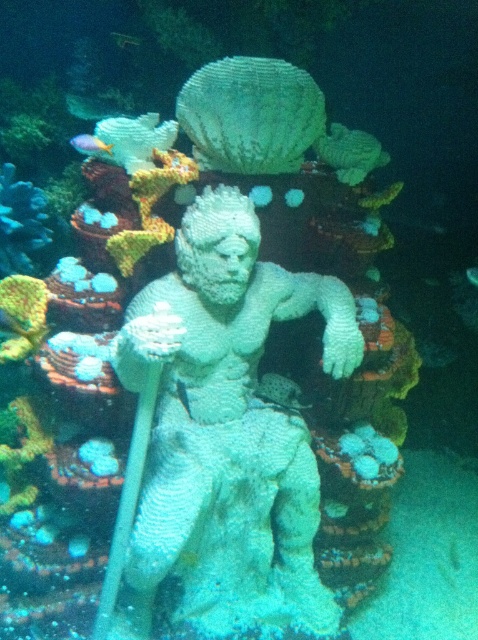
Does white textured statue at center have a greater height compared to green translucent fish at center?

Yes.

Is white textured statue at center to the right of green translucent fish at center from the viewer's perspective?

No, white textured statue at center is not to the right of green translucent fish at center.

Is point (238, 211) closer to camera compared to point (467, 269)?

Yes, it is in front of point (467, 269).

This screenshot has height=640, width=478. Identify the location of white textured statue at center. (226, 429).

Is white textured statue at center behind shiny yellow fish at upper left?

No, white textured statue at center is closer to the viewer.

Is white textured statue at center positioned before shiny yellow fish at upper left?

Yes, white textured statue at center is in front of shiny yellow fish at upper left.

Does point (149, 545) come in front of point (86, 145)?

That is True.

Identify the location of white textured statue at center. Image resolution: width=478 pixels, height=640 pixels. (226, 429).

Between point (82, 145) and point (474, 269), which one is positioned behind?

Point (474, 269)

Between shiny yellow fish at upper left and green translucent fish at center, which one appears on the right side from the viewer's perspective?

green translucent fish at center

In the scene shown: Who is more distant from viewer, (69, 140) or (467, 269)?

The point (467, 269) is behind.

Where is `shiny yellow fish at upper left`? The image size is (478, 640). shiny yellow fish at upper left is located at coordinates (89, 145).